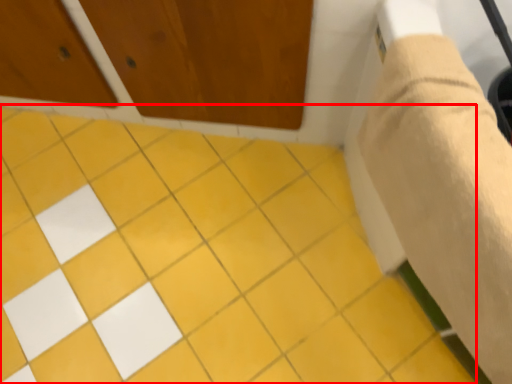
Question: Where is ceramic tile (annotated by the red box) located in relation to plaster bandage in the image?

Choices:
 (A) right
 (B) left

Answer: (B)